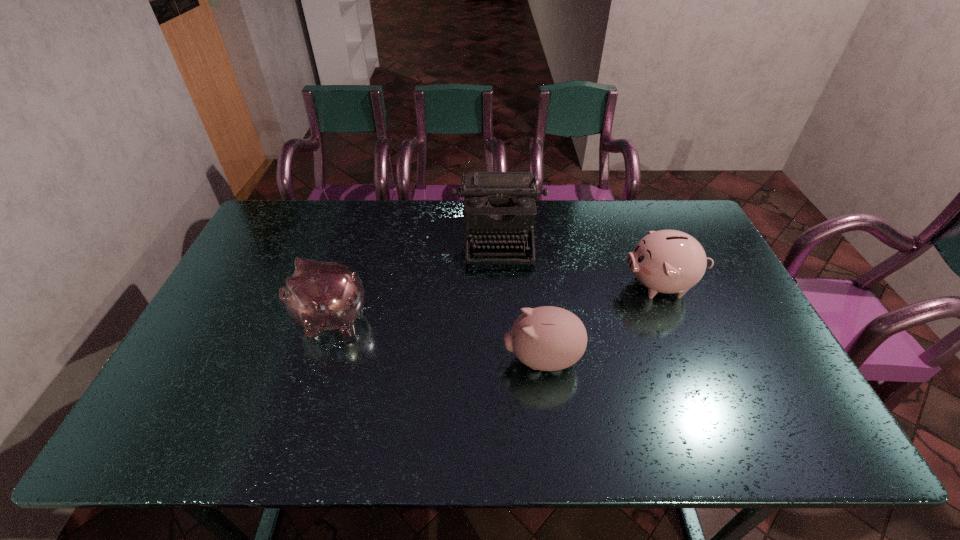
The width and height of the screenshot is (960, 540). In order to click on free space located 0.340m at the snout of the second piggy bank from right to left in this screenshot , I will do `click(369, 359)`.

Find the location of a particular element. The image size is (960, 540). vacant space located 0.250m at the snout of the second piggy bank from right to left is located at coordinates (404, 359).

Locate an element on the screen. This screenshot has width=960, height=540. object at the far edge is located at coordinates (499, 206).

I want to click on object present at the right edge, so click(x=666, y=261).

Where is `free region at the far edge of the desktop`? free region at the far edge of the desktop is located at coordinates pyautogui.click(x=613, y=204).

Find the location of a particular element. This screenshot has height=540, width=960. free space at the near edge is located at coordinates (261, 446).

The width and height of the screenshot is (960, 540). I want to click on free space at the left edge, so click(x=284, y=277).

Identify the location of vacant space at the right edge of the desktop. (715, 329).

The image size is (960, 540). Find the location of `vacant space at the far left corner`. vacant space at the far left corner is located at coordinates (301, 223).

I want to click on unoccupied position between the rightmost piggy bank and the typewriter, so click(581, 262).